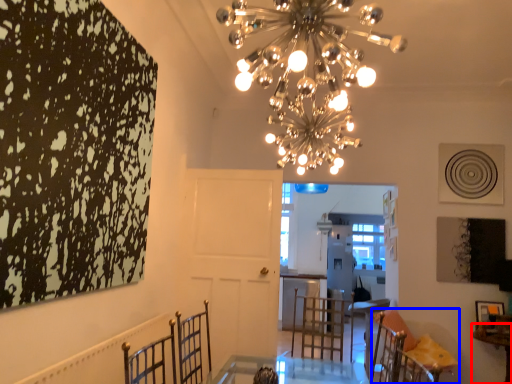
Question: Which point is further to the camera, table (highlighted by a red box) or furniture (highlighted by a blue box)?

Choices:
 (A) table
 (B) furniture

Answer: (B)